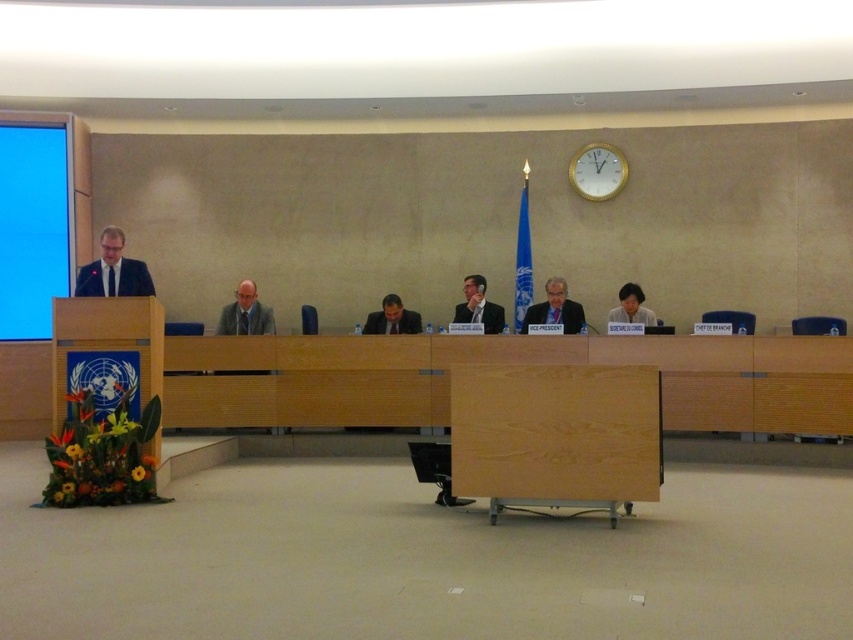
Question: Can you confirm if dark blue suit at center is wider than matte black suit at center?

Choices:
 (A) yes
 (B) no

Answer: (A)

Question: Is dark blue suit at center to the right of matte black laptop at lower right from the viewer's perspective?

Choices:
 (A) no
 (B) yes

Answer: (A)

Question: Can you confirm if matte black suit at center is bigger than matte black laptop at lower right?

Choices:
 (A) no
 (B) yes

Answer: (A)

Question: Among these points, which one is nearest to the camera?

Choices:
 (A) (265, 310)
 (B) (485, 323)

Answer: (B)

Question: Which point is closer to the camera taking this photo?

Choices:
 (A) (48, 314)
 (B) (76, 276)

Answer: (A)

Question: Which of the following is the closest to the observer?

Choices:
 (A) matte black laptop at lower right
 (B) matte black suit at center
 (C) dark blue suit at center

Answer: (C)